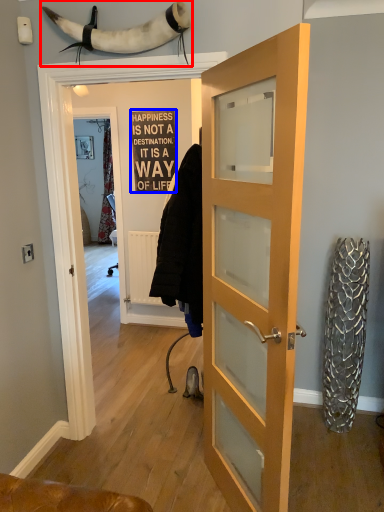
Question: Which of the following is the closest to the observer, animal (highlighted by a red box) or writing (highlighted by a blue box)?

Choices:
 (A) animal
 (B) writing

Answer: (A)